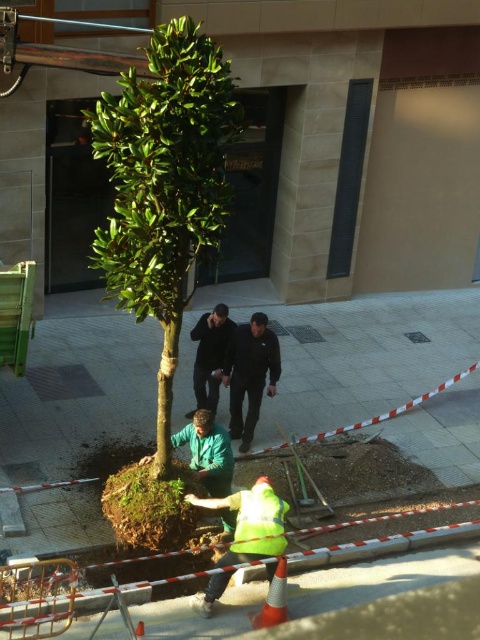
Can you confirm if high visibility yellow jacket at lower center is wider than high visibility yellow safety vest at lower center?

Yes.

This screenshot has width=480, height=640. Describe the element at coordinates (251, 522) in the screenshot. I see `high visibility yellow jacket at lower center` at that location.

Is point (195, 500) more distant than point (279, 531)?

Yes, it is.

Image resolution: width=480 pixels, height=640 pixels. What are the coordinates of `high visibility yellow jacket at lower center` in the screenshot? It's located at (251, 522).

Is green leafy tree at center below high visibility yellow safety vest at lower center?

No.

Can you confirm if green leafy tree at center is taller than high visibility yellow safety vest at lower center?

Yes.

I want to click on green leafy tree at center, so pos(164,186).

Where is `green leafy tree at center`? green leafy tree at center is located at coordinates (164, 186).

Is high visibility yellow jacket at lower center wider than black smooth jacket at center?

Correct, the width of high visibility yellow jacket at lower center exceeds that of black smooth jacket at center.

Between point (192, 493) and point (196, 371), which one is positioned behind?

Positioned behind is point (196, 371).

The width and height of the screenshot is (480, 640). In order to click on high visibility yellow jacket at lower center in this screenshot , I will do `click(251, 522)`.